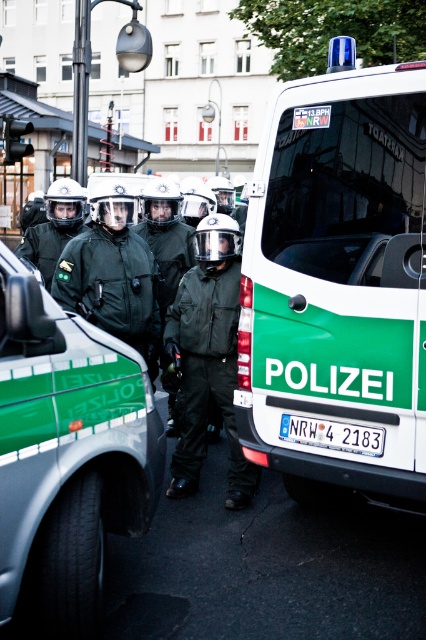
Is matte black helmet at center positioned at the back of white plastic license plate at center?

Yes.

Between matte black helmet at center and white plastic license plate at center, which one appears on the right side from the viewer's perspective?

white plastic license plate at center

Which is behind, point (40, 266) or point (377, 445)?

The point (40, 266) is more distant.

Locate an element on the screen. The width and height of the screenshot is (426, 640). matte black helmet at center is located at coordinates (54, 227).

The width and height of the screenshot is (426, 640). What do you see at coordinates (337, 285) in the screenshot?
I see `green matte van at center` at bounding box center [337, 285].

Which of these two, green matte van at center or matte black uniform at center, stands shorter?

With less height is matte black uniform at center.

Locate an element on the screen. This screenshot has width=426, height=640. green matte van at center is located at coordinates (337, 285).

Who is more forward, (143, 272) or (54, 184)?

Point (143, 272)

Does green matte uniform at center appear under matte black helmet at center?

Correct, green matte uniform at center is located below matte black helmet at center.

Does point (109, 310) lie in front of point (31, 257)?

That is True.

The height and width of the screenshot is (640, 426). I want to click on green matte uniform at center, so click(112, 275).